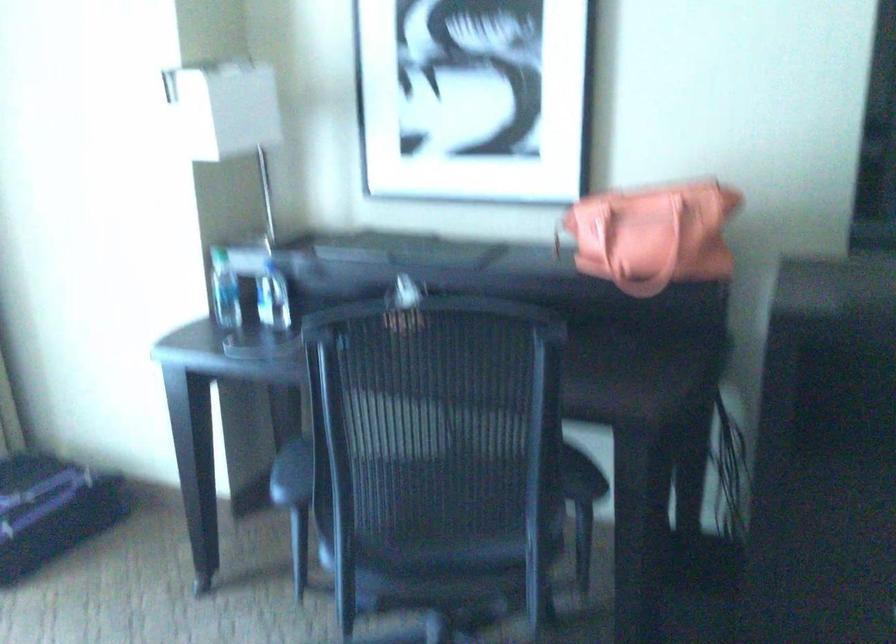
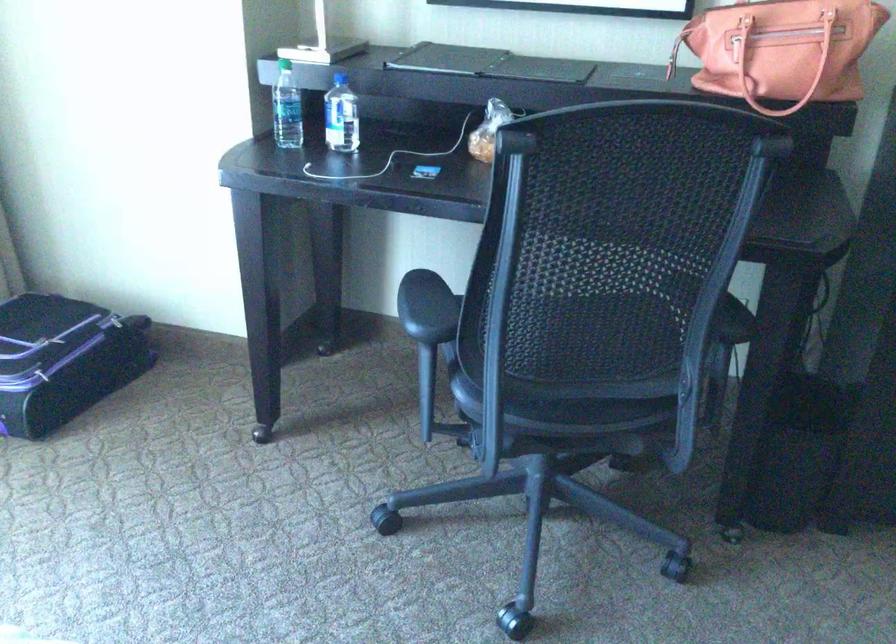
Consider the image. In a continuous first-person perspective shot, in which direction is the camera moving?

The cameraman walked toward left, forward.